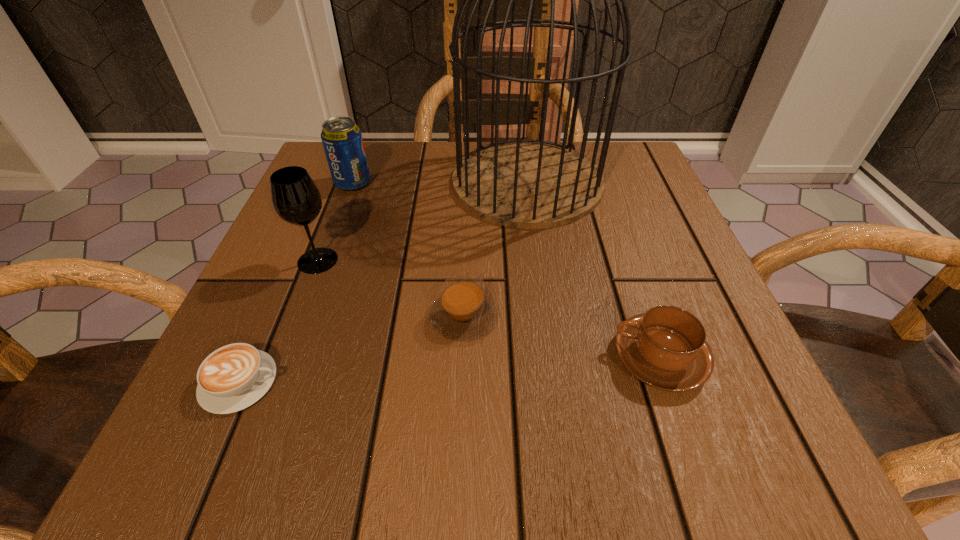
Identify the location of the tallest object. (523, 183).

Where is `the fifth shortest object`? the fifth shortest object is located at coordinates (296, 199).

Locate an element on the screen. The width and height of the screenshot is (960, 540). the third farthest object is located at coordinates (296, 199).

Where is `the fourth shortest object`? This screenshot has height=540, width=960. the fourth shortest object is located at coordinates (342, 140).

This screenshot has height=540, width=960. I want to click on the rightmost cappuccino, so click(666, 348).

Image resolution: width=960 pixels, height=540 pixels. I want to click on the second shortest object, so click(462, 312).

Identify the location of the second cappuccino from left to right. (462, 312).

Locate an element on the screen. The width and height of the screenshot is (960, 540). the shortest object is located at coordinates (233, 377).

At what (x,y) coordinates should I click in order to perform the action: click on the leftmost cappuccino. Please return your answer as a coordinate pair (x, y). The width and height of the screenshot is (960, 540). Looking at the image, I should click on (233, 377).

Locate an element on the screen. Image resolution: width=960 pixels, height=540 pixels. vacant region located at the door of the birdcage is located at coordinates (410, 182).